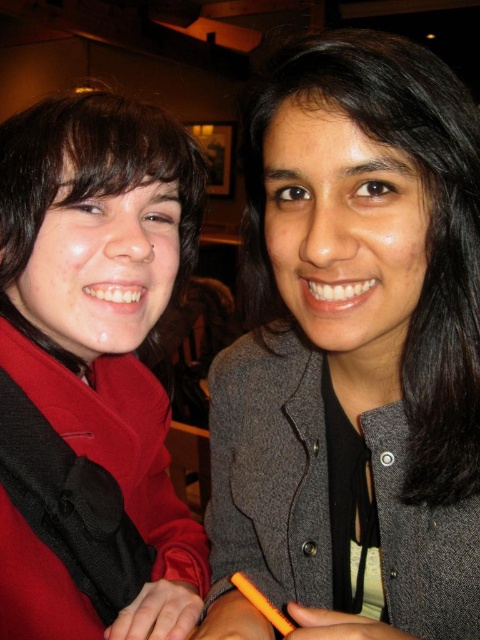
What do you see at coordinates (352, 353) in the screenshot? I see `gray woolen jacket at center` at bounding box center [352, 353].

In the scene shown: Which is above, gray woolen jacket at center or matte red coat at left?

Positioned higher is gray woolen jacket at center.

What are the coordinates of `gray woolen jacket at center` in the screenshot? It's located at (352, 353).

This screenshot has height=640, width=480. In order to click on gray woolen jacket at center in this screenshot , I will do `click(352, 353)`.